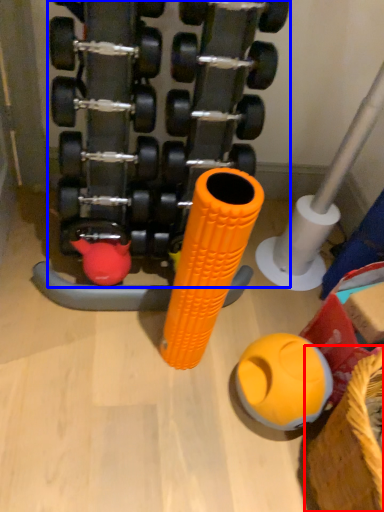
Question: Which point is closer to the camera, basket (highlighted by a red box) or dumbbell (highlighted by a blue box)?

Choices:
 (A) basket
 (B) dumbbell

Answer: (B)